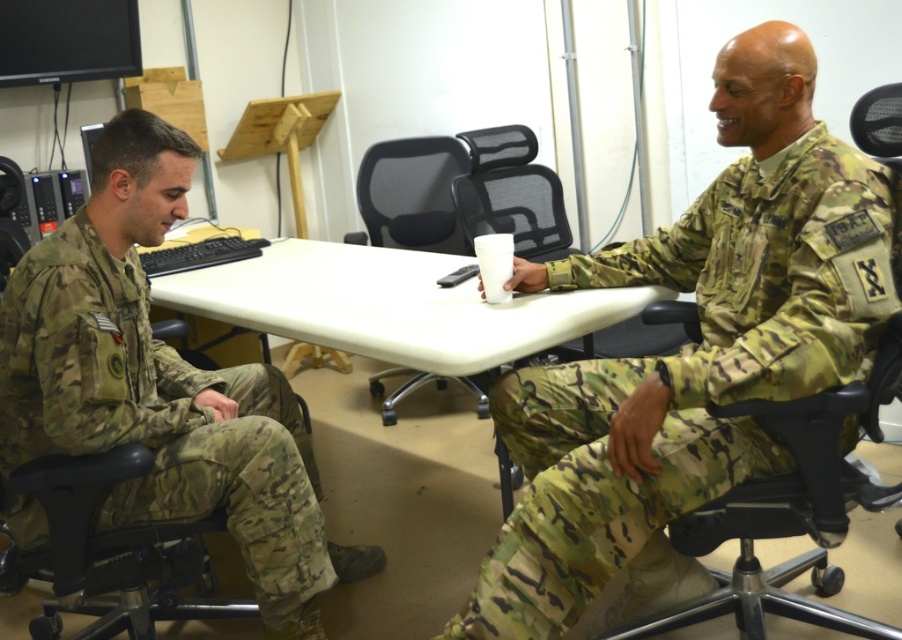
You are a maintenance worker in the office. You need to move the camouflage uniform at left and the black mesh office chair at center to another room. Which object should you move first to access the space behind them?

You should move the camouflage uniform at left first because it is in front of the black mesh office chair at center, allowing you to access the space behind both objects more easily.

You are an interior designer planning to place a large sofa in this office. The sofa you have chosen is the same size as the camo fabric uniform at right. Will it fit in the space where the black mesh office chair at center is currently located?

The camo fabric uniform at right has a larger size compared to the black mesh office chair at center. Since the sofa is the same size as the camo fabric uniform at right, it will not fit in the space where the black mesh office chair at center is located because it is larger.

You are a photographer setting up for a group photo in the office scene described. You need to ensure everyone is visible. Considering the camouflage uniform at left and the black mesh office chair at center, which one is taller and might block the view of the other?

The camouflage uniform at left is taller than the black mesh office chair at center, so it might block the view of the chair.